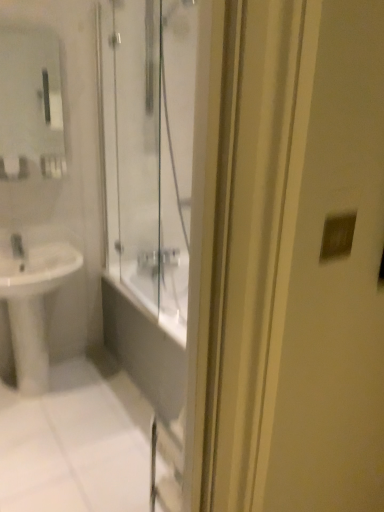
Question: Is the depth of white glossy sink at lower left greater than that of matte glass mirror at upper left?

Choices:
 (A) no
 (B) yes

Answer: (A)

Question: Can we say white glossy sink at lower left lies outside matte glass mirror at upper left?

Choices:
 (A) no
 (B) yes

Answer: (B)

Question: Can you confirm if white glossy sink at lower left is wider than matte glass mirror at upper left?

Choices:
 (A) no
 (B) yes

Answer: (B)

Question: Can you confirm if white glossy sink at lower left is bigger than matte glass mirror at upper left?

Choices:
 (A) yes
 (B) no

Answer: (A)

Question: Is white glossy sink at lower left facing away from matte glass mirror at upper left?

Choices:
 (A) yes
 (B) no

Answer: (B)

Question: From the image's perspective, is white glossy sink at lower left located beneath matte glass mirror at upper left?

Choices:
 (A) no
 (B) yes

Answer: (B)

Question: Does matte glass mirror at upper left have a larger size compared to white glossy sink at lower left?

Choices:
 (A) yes
 (B) no

Answer: (B)

Question: Considering the relative sizes of matte glass mirror at upper left and white glossy sink at lower left in the image provided, is matte glass mirror at upper left taller than white glossy sink at lower left?

Choices:
 (A) yes
 (B) no

Answer: (B)

Question: Is matte glass mirror at upper left to the right of white glossy sink at lower left from the viewer's perspective?

Choices:
 (A) no
 (B) yes

Answer: (B)

Question: From the image's perspective, does matte glass mirror at upper left appear lower than white glossy sink at lower left?

Choices:
 (A) yes
 (B) no

Answer: (B)

Question: Is matte glass mirror at upper left directly adjacent to white glossy sink at lower left?

Choices:
 (A) yes
 (B) no

Answer: (B)

Question: Could you tell me if matte glass mirror at upper left is facing white glossy sink at lower left?

Choices:
 (A) no
 (B) yes

Answer: (A)

Question: From a real-world perspective, is matte silver switch at upper right under white glossy sink at lower left?

Choices:
 (A) yes
 (B) no

Answer: (B)